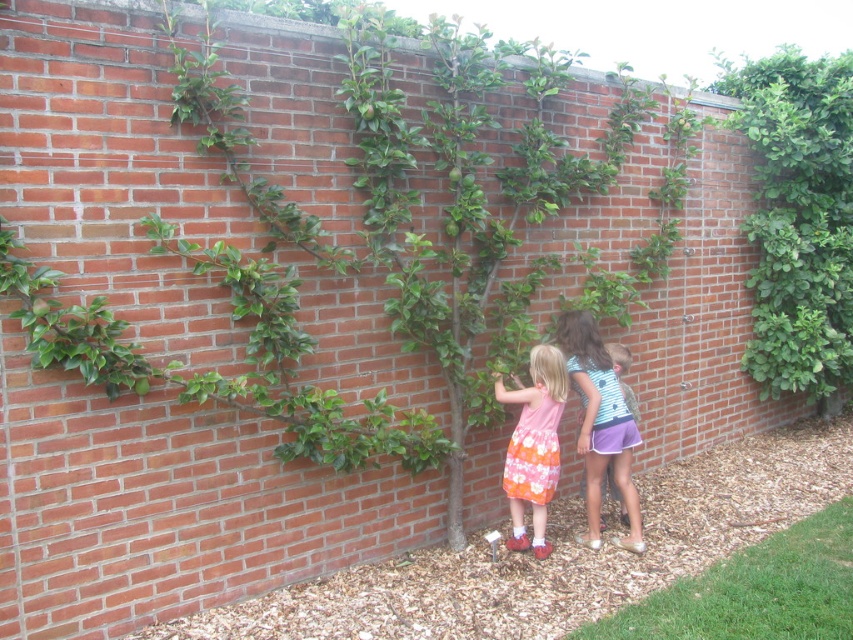
Question: Which object is the farthest from the green leafy bush at upper right?

Choices:
 (A) striped cotton shirt at center
 (B) floral cotton dress at center

Answer: (B)

Question: Does green leafy bush at upper right appear over floral cotton dress at center?

Choices:
 (A) no
 (B) yes

Answer: (B)

Question: Is the position of striped cotton shirt at center less distant than that of floral cotton dress at center?

Choices:
 (A) no
 (B) yes

Answer: (A)

Question: Among these points, which one is nearest to the camera?

Choices:
 (A) (515, 448)
 (B) (631, 500)

Answer: (A)

Question: Which object appears closest to the camera in this image?

Choices:
 (A) green leafy bush at upper right
 (B) floral cotton dress at center
 (C) striped cotton shirt at center

Answer: (B)

Question: Does striped cotton shirt at center lie in front of floral cotton dress at center?

Choices:
 (A) yes
 (B) no

Answer: (B)